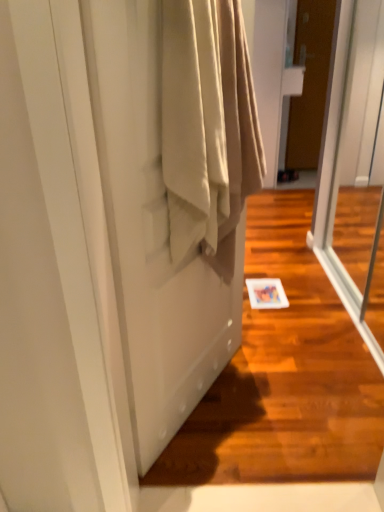
The height and width of the screenshot is (512, 384). Find the location of `free space in front of transparent glass screen door at right, arranged as the 2th screen door when viewed from the left`. free space in front of transparent glass screen door at right, arranged as the 2th screen door when viewed from the left is located at coordinates (323, 388).